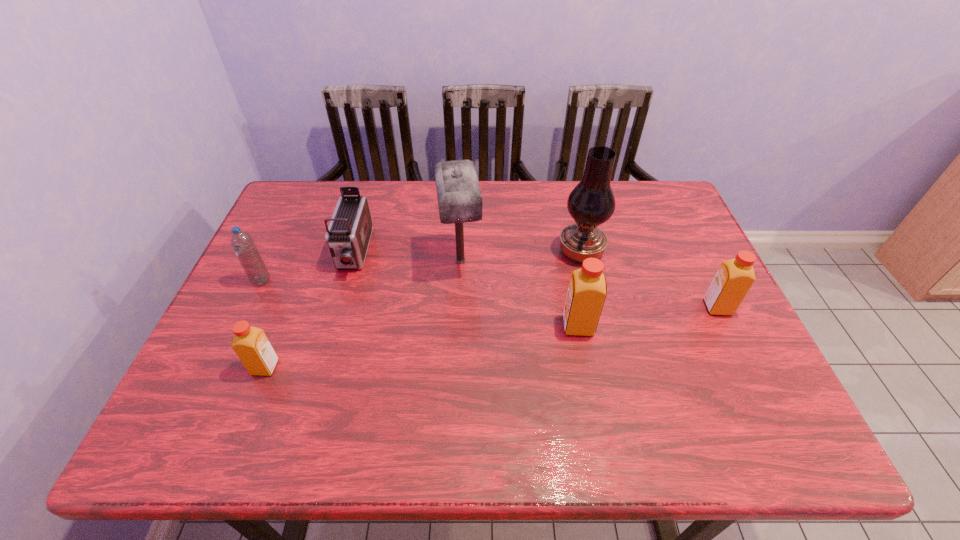
To ensure equal spacing by inserting another orange_juice among them, please point out a vacant spot for this new orange_juice. Please provide its 2D coordinates. Your answer should be formatted as a tuple, i.e. [(x, y)], where the tuple contains the x and y coordinates of a point satisfying the conditions above.

[(428, 346)]